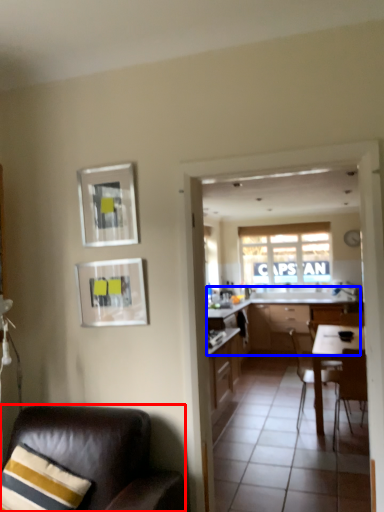
Question: Among these objects, which one is nearest to the camera, chair (highlighted by a red box) or cabinetry (highlighted by a blue box)?

Choices:
 (A) chair
 (B) cabinetry

Answer: (A)